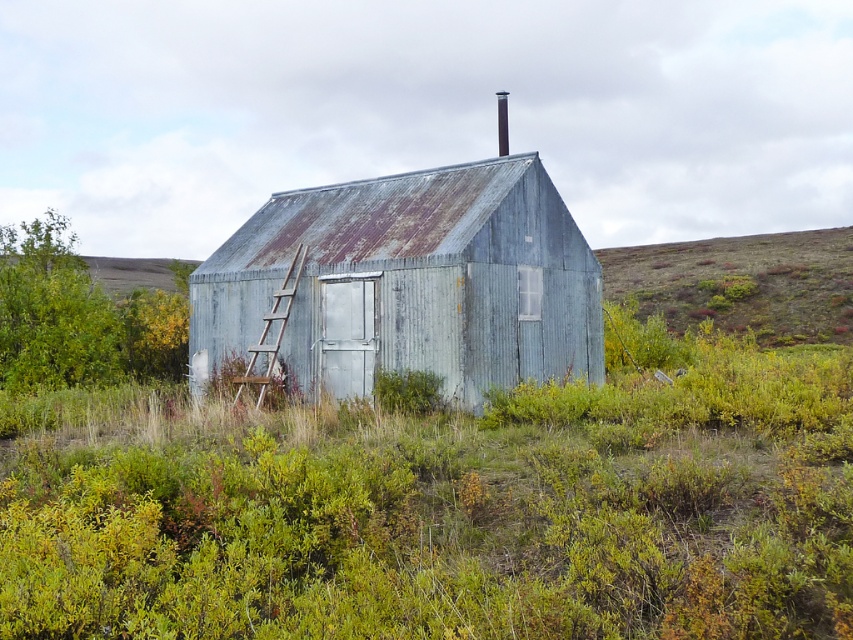
You are standing in front of the shed and want to enter it. The door is locked. You see the rusty corrugated metal hut at center and the wooden ladder at center. Which object should you move first to reach the door?

You should move the wooden ladder at center first because the rusty corrugated metal hut at center is closer to the viewer than the wooden ladder at center, meaning the ladder is farther away and not blocking the immediate path to the door.

You are standing in front of the shed and want to locate the point at coordinates (405, 284). Where exactly on the shed would you find this point?

The point at coordinates (405, 284) is located on the rusty corrugated metal hut at center.

Looking at this image, you are standing in front of the shed and want to determine which of the two points, point [309,232] or point [291,269], is closer to you. Based on the coordinates provided, which point is nearer?

Point [309,232] is further to the viewer than point [291,269], so the closer point to you is point [291,269].